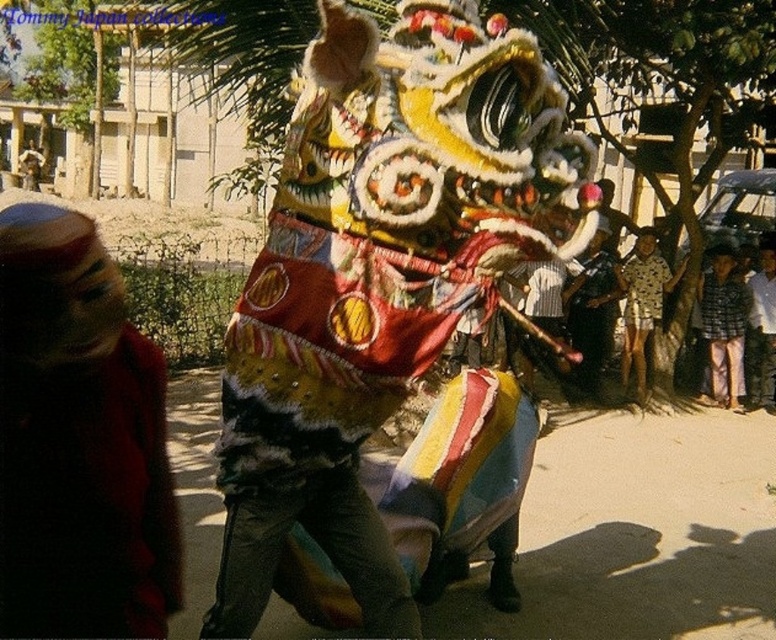
You are organizing a clothing store and need to arrange the plaid fabric shirt at right and the printed cotton shirt at center on a shelf. Which shirt should be placed on the left side of the shelf to ensure they fit properly?

The plaid fabric shirt at right has a smaller width than the printed cotton shirt at center, so placing the plaid fabric shirt at right on the left side would allow the printed cotton shirt at center to fit on the right side without overcrowding the shelf.

You are a photographer standing at a certain position to capture the lion dance performance. You want to ensure that the point at coordinate point (161, 387) is in focus. What is the minimum distance you need to be from the camera to ensure this point is in focus?

The minimum distance required to ensure the point (161, 387) is in focus is 1.57 meters, as that is the distance of the point from the camera.